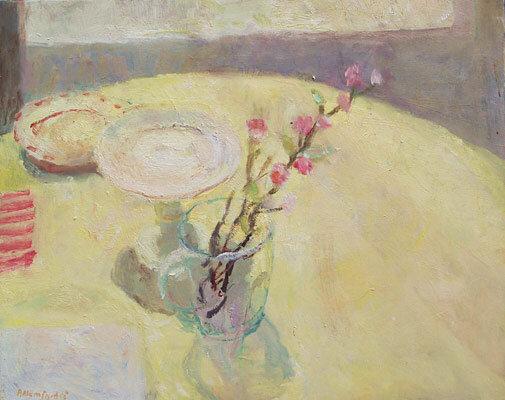
This screenshot has width=505, height=400. I want to click on cake plate, so click(x=165, y=149).